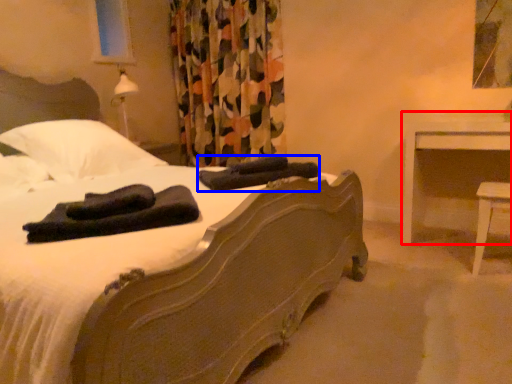
Question: Among these objects, which one is nearest to the camera, nightstand (highlighted by a red box) or material (highlighted by a blue box)?

Choices:
 (A) nightstand
 (B) material

Answer: (B)